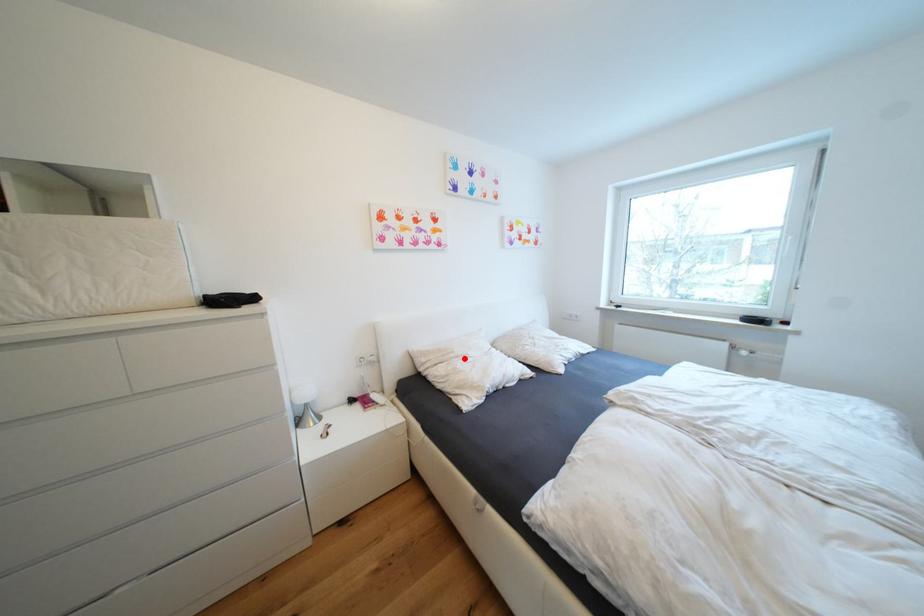
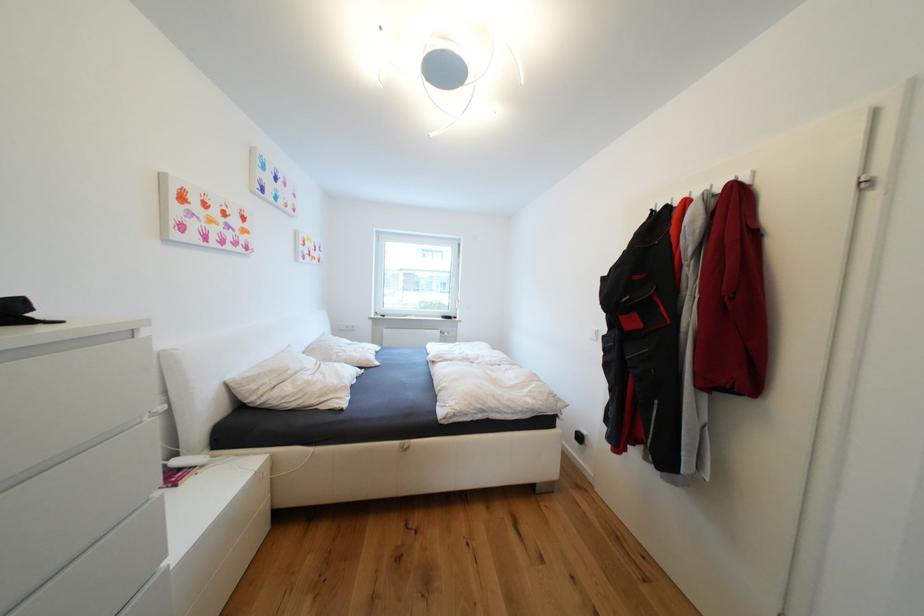
The point at the highlighted location is marked in the first image. Where is the corresponding point in the second image?

(304, 374)